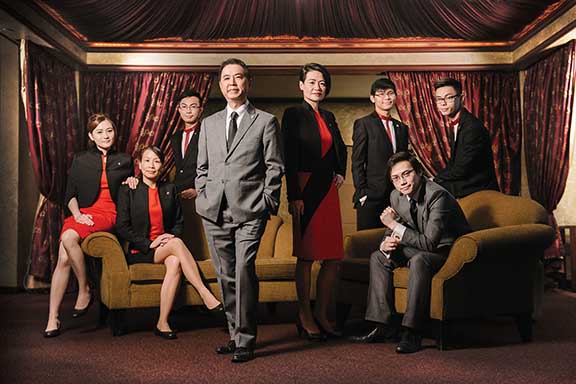
At what (x,y) coordinates should I click in order to perform the action: click on brown chairs. Please return your answer as a coordinate pair (x, y). The width and height of the screenshot is (576, 384). Looking at the image, I should click on (121, 276), (265, 272), (355, 241), (450, 269).